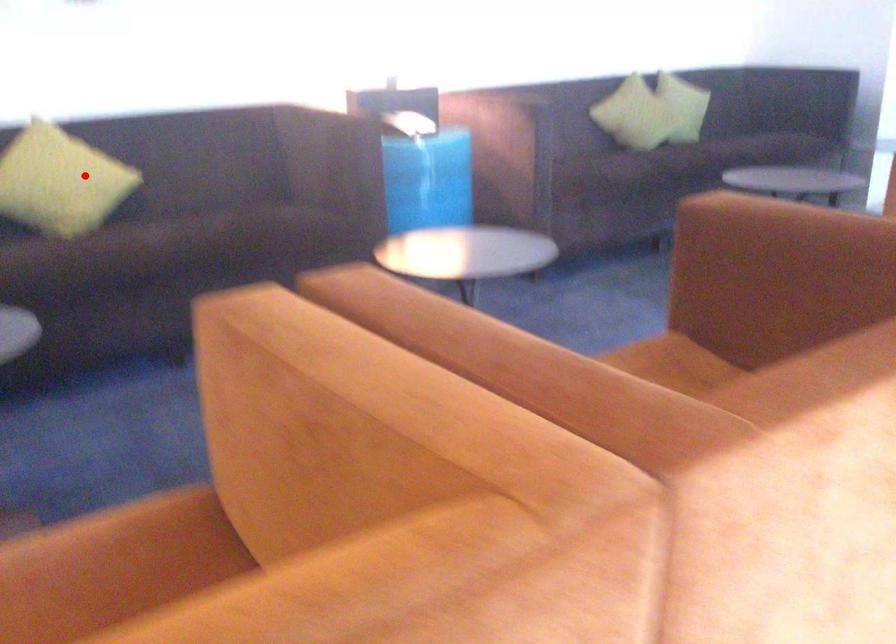
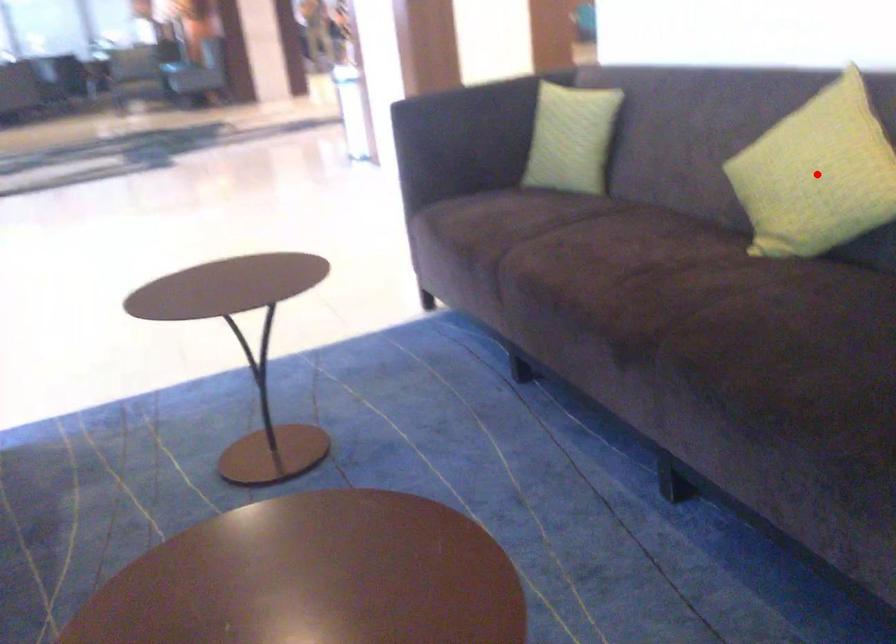
I am providing you with two images of the same scene from different viewpoints. A red point is marked on the first image and another point is marked on the second image. Is the marked point in image1 the same physical position as the marked point in image2?

Yes